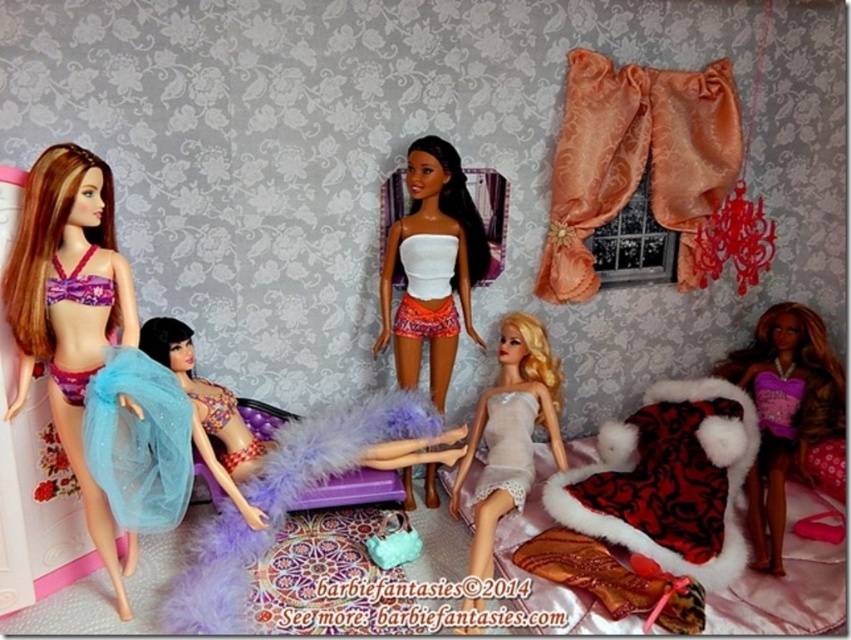
Is matte purple bikini at left below white satin dress at center?

Incorrect, matte purple bikini at left is not positioned below white satin dress at center.

Describe the element at coordinates (94, 356) in the screenshot. I see `matte purple bikini at left` at that location.

Which is behind, point (14, 241) or point (495, 464)?

The point (495, 464) is behind.

Locate an element on the screen. Image resolution: width=851 pixels, height=640 pixels. matte purple bikini at left is located at coordinates click(94, 356).

Between white satin dress at center and translucent blue fabric at center, which one has more height?

With more height is white satin dress at center.

Does point (524, 330) come farther from viewer compared to point (233, 490)?

Yes, point (524, 330) is behind point (233, 490).

Is point (470, 429) closer to camera compared to point (230, 493)?

No, (470, 429) is behind (230, 493).

Identify the location of white satin dress at center. click(x=510, y=432).

Who is more distant from viewer, (678, 420) or (412, 216)?

Point (678, 420)

Does red velvet stockings at lower right have a smaller size compared to white matte skirt at center?

Actually, red velvet stockings at lower right might be larger than white matte skirt at center.

At what (x,y) coordinates should I click in order to perform the action: click on red velvet stockings at lower right. Please return your answer as a coordinate pair (x, y). Looking at the image, I should click on (667, 481).